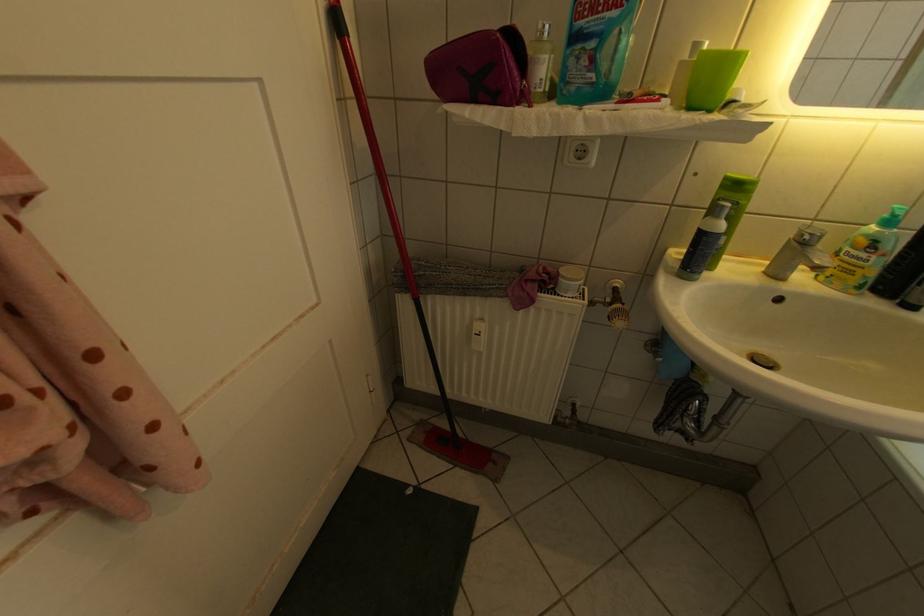
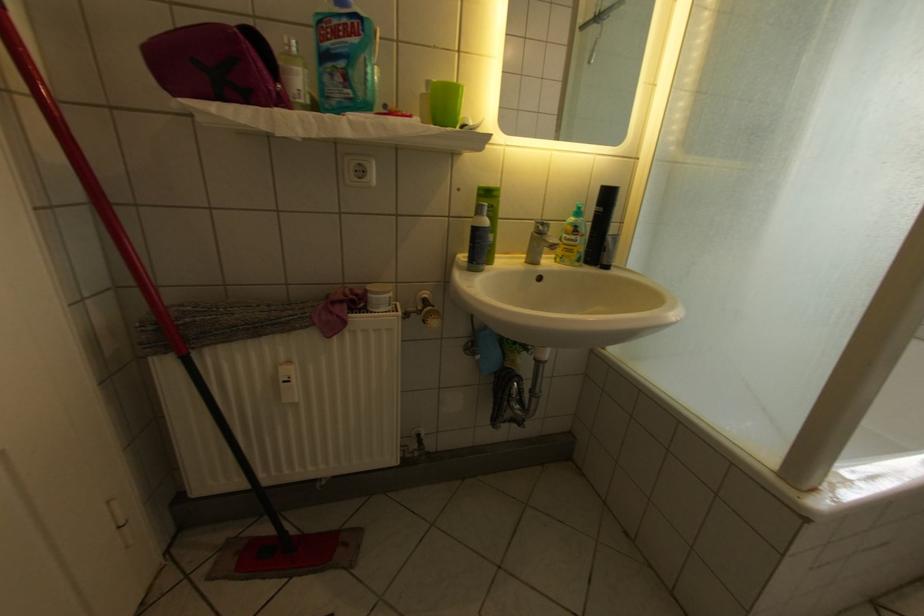
Locate, in the second image, the point that corresponds to [681,273] in the first image.

(472, 270)